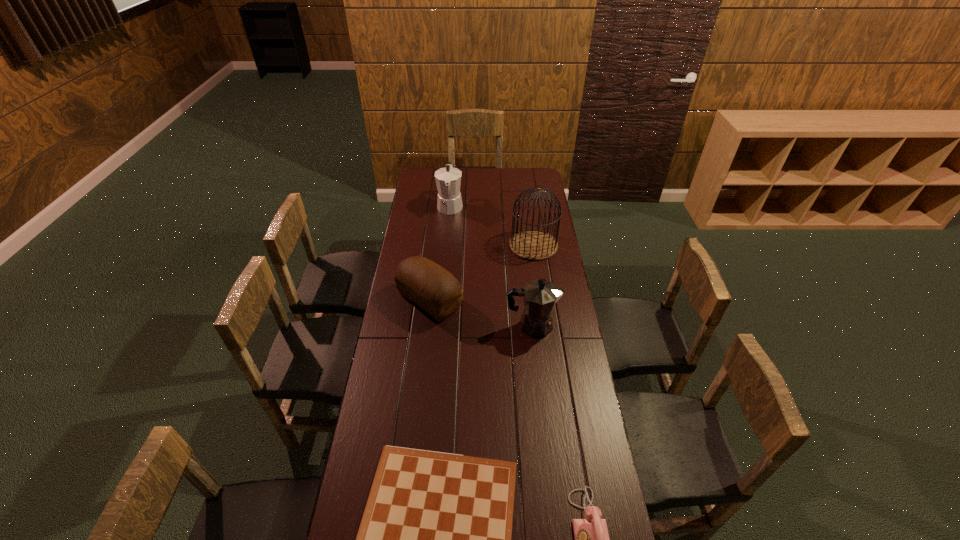
The width and height of the screenshot is (960, 540). Identify the location of free space located 0.060m on the pouring side of the right coffeepot. (574, 326).

The image size is (960, 540). I want to click on vacant space located on the right of the bread, so click(506, 300).

Locate an element on the screen. The image size is (960, 540). coffeepot located in the left edge section of the desktop is located at coordinates (448, 180).

The image size is (960, 540). Find the location of `bread at the left edge`. bread at the left edge is located at coordinates (420, 280).

Where is `birdcage that is at the right edge`? birdcage that is at the right edge is located at coordinates (531, 244).

What are the coordinates of `coffeepot situated at the right edge` in the screenshot? It's located at (539, 296).

This screenshot has width=960, height=540. In the image, there is a desktop. Identify the location of vacant space at the far edge. point(469,174).

I want to click on free region at the left edge of the desktop, so click(x=404, y=371).

The height and width of the screenshot is (540, 960). I want to click on free point at the right edge, so click(533, 196).

Where is `free space between the fifth nearest object and the left coffeepot`? The height and width of the screenshot is (540, 960). free space between the fifth nearest object and the left coffeepot is located at coordinates (492, 225).